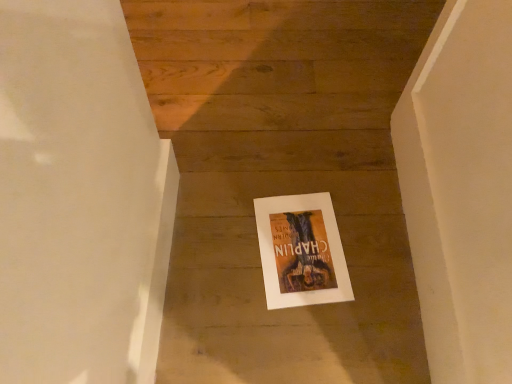
Where is `vacant area situated to the left side of white paper at center`? This screenshot has height=384, width=512. vacant area situated to the left side of white paper at center is located at coordinates 211,241.